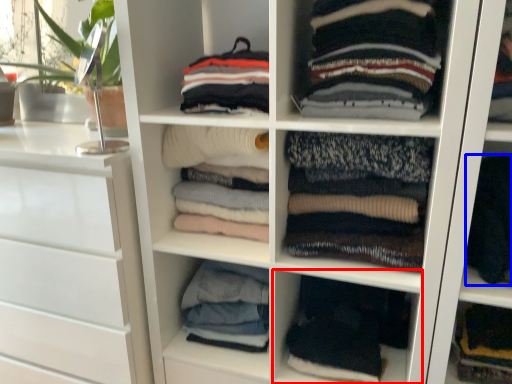
Question: Which point is closer to the camera, shelf (highlighted by a red box) or clothing (highlighted by a blue box)?

Choices:
 (A) shelf
 (B) clothing

Answer: (B)